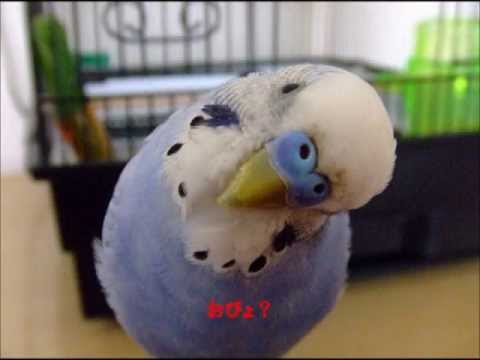
The image size is (480, 360). In order to click on floor in this screenshot , I will do (403, 341).